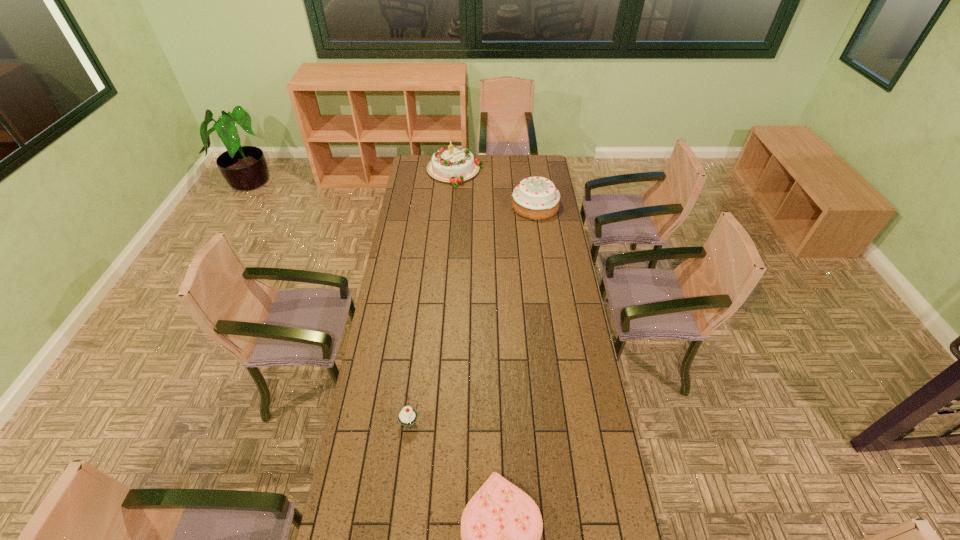
This screenshot has width=960, height=540. Identify the location of object present at the right edge. (536, 198).

At what (x,y) coordinates should I click in order to perform the action: click on object that is at the far left corner. Please return your answer as a coordinate pair (x, y). Looking at the image, I should click on (455, 164).

The image size is (960, 540). In the image, there is a desktop. In order to click on vacant space at the left edge in this screenshot , I will do `click(385, 383)`.

In the image, there is a desktop. Where is `vacant space at the right edge`? vacant space at the right edge is located at coordinates (612, 514).

Image resolution: width=960 pixels, height=540 pixels. I want to click on vacant space at the far left corner, so click(426, 173).

This screenshot has width=960, height=540. What are the coordinates of `vacant area that lies between the second shortest object and the third nearest object` in the screenshot? It's located at (472, 314).

Where is `vacant area between the farthest object and the cupcake`? The height and width of the screenshot is (540, 960). vacant area between the farthest object and the cupcake is located at coordinates (432, 297).

Locate an element on the screen. The width and height of the screenshot is (960, 540). vacant space in between the farthest object and the second nearest object is located at coordinates (x=432, y=297).

What are the coordinates of `free space between the farthest cake and the second farthest object` in the screenshot? It's located at (495, 189).

Where is `empty location between the third nearest object and the second nearest object`? empty location between the third nearest object and the second nearest object is located at coordinates (472, 314).